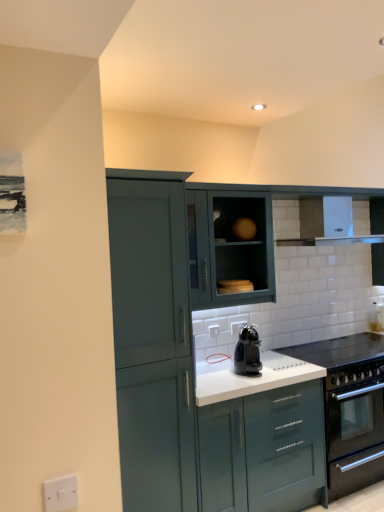
Question: Can you confirm if white plastic electric outlet at lower left is positioned to the left of white glossy countertop at center?

Choices:
 (A) yes
 (B) no

Answer: (A)

Question: Can you confirm if white plastic electric outlet at lower left is positioned to the right of white glossy countertop at center?

Choices:
 (A) no
 (B) yes

Answer: (A)

Question: From the image's perspective, is white plastic electric outlet at lower left located above white glossy countertop at center?

Choices:
 (A) yes
 (B) no

Answer: (A)

Question: Can you confirm if white plastic electric outlet at lower left is thinner than white glossy countertop at center?

Choices:
 (A) yes
 (B) no

Answer: (A)

Question: Is white plastic electric outlet at lower left next to white glossy countertop at center?

Choices:
 (A) yes
 (B) no

Answer: (B)

Question: Choose the correct answer: Is matte teal cabinet at left, arranged as the fourth cabinetry when viewed from the back, inside white glossy countertop at center or outside it?

Choices:
 (A) outside
 (B) inside

Answer: (A)

Question: Considering the positions of matte teal cabinet at left, the first cabinetry from the front, and white glossy countertop at center in the image, is matte teal cabinet at left, the first cabinetry from the front, wider or thinner than white glossy countertop at center?

Choices:
 (A) thin
 (B) wide

Answer: (B)

Question: Considering the positions of point (145, 426) and point (311, 355), is point (145, 426) closer or farther from the camera than point (311, 355)?

Choices:
 (A) farther
 (B) closer

Answer: (B)

Question: In terms of height, does matte teal cabinet at left, arranged as the fourth cabinetry when viewed from the back, look taller or shorter compared to white glossy countertop at center?

Choices:
 (A) short
 (B) tall

Answer: (B)

Question: From the image's perspective, is white glossy countertop at center positioned above or below matte dark green cabinet at upper center, the 3th cabinetry positioned from the front?

Choices:
 (A) above
 (B) below

Answer: (B)

Question: Considering the positions of point (367, 352) and point (213, 230), is point (367, 352) closer or farther from the camera than point (213, 230)?

Choices:
 (A) farther
 (B) closer

Answer: (A)

Question: Is white glossy countertop at center taller or shorter than matte dark green cabinet at upper center, the 2th cabinetry from the back?

Choices:
 (A) short
 (B) tall

Answer: (A)

Question: From a real-world perspective, is white glossy countertop at center physically located above or below matte dark green cabinet at upper center, the 2th cabinetry from the back?

Choices:
 (A) above
 (B) below

Answer: (B)

Question: Considering the positions of matte teal cabinet at center, arranged as the 2th cabinetry when viewed from the front, and black plastic coffee machine at center in the image, is matte teal cabinet at center, arranged as the 2th cabinetry when viewed from the front, bigger or smaller than black plastic coffee machine at center?

Choices:
 (A) small
 (B) big

Answer: (B)

Question: Is matte teal cabinet at center, which is the 3th cabinetry in back-to-front order, in front of or behind black plastic coffee machine at center in the image?

Choices:
 (A) behind
 (B) front

Answer: (B)